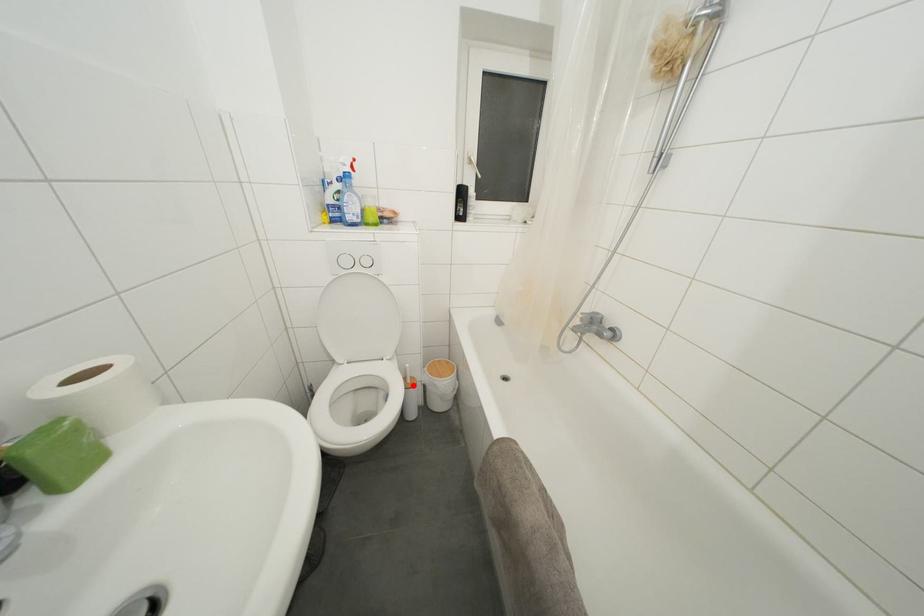
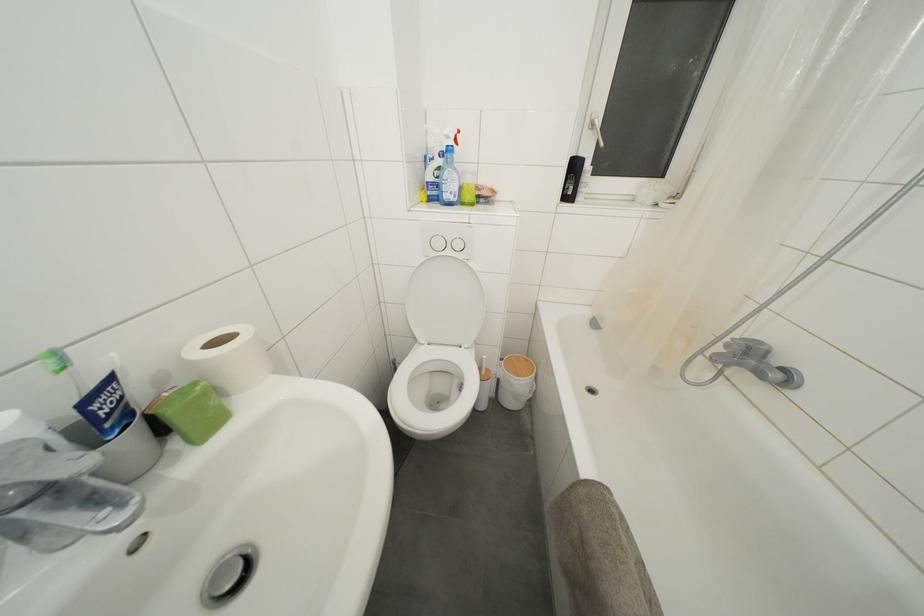
Question: I am providing you with two images of the same scene from different viewpoints. In image1, a red point is highlighted. Considering the same 3D point in image2, which of the following is correct?

Choices:
 (A) It is closer
 (B) It is farther

Answer: (B)